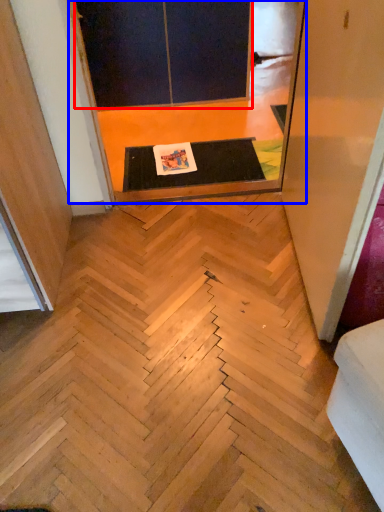
Question: Which point is further to the camera, screen door (highlighted by a red box) or screen door (highlighted by a blue box)?

Choices:
 (A) screen door
 (B) screen door

Answer: (A)